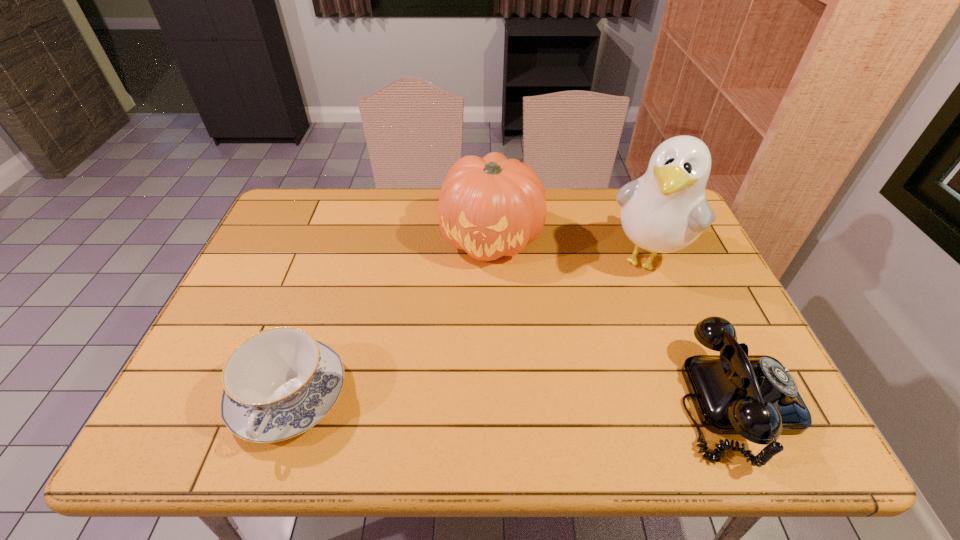
This screenshot has width=960, height=540. What are the coordinates of `vacant region located on the beak of the gull` in the screenshot? It's located at (626, 299).

You are a GUI agent. You are given a task and a screenshot of the screen. Output one action in this format:
    pyautogui.click(x=<x>, y=<y>)
    Task: Click on the free space located 0.190m on the beak of the gull
    The height and width of the screenshot is (540, 960).
    Given the screenshot: What is the action you would take?
    pyautogui.click(x=606, y=334)

This screenshot has width=960, height=540. In order to click on pumpkin present at the far edge in this screenshot , I will do `click(490, 207)`.

In order to click on gull that is at the far edge in this screenshot , I will do `click(665, 210)`.

This screenshot has height=540, width=960. In order to click on chinaware that is at the near edge in this screenshot , I will do `click(277, 384)`.

At what (x,y) coordinates should I click in order to perform the action: click on telephone located in the near edge section of the desktop. Please return your answer as a coordinate pair (x, y). Looking at the image, I should click on (x=755, y=396).

Where is `object at the left edge`? object at the left edge is located at coordinates (277, 384).

The height and width of the screenshot is (540, 960). What are the coordinates of `telephone that is at the right edge` in the screenshot? It's located at (755, 396).

This screenshot has height=540, width=960. In order to click on gull at the right edge in this screenshot , I will do `click(665, 210)`.

The height and width of the screenshot is (540, 960). What are the coordinates of `object that is at the near left corner` in the screenshot? It's located at (277, 384).